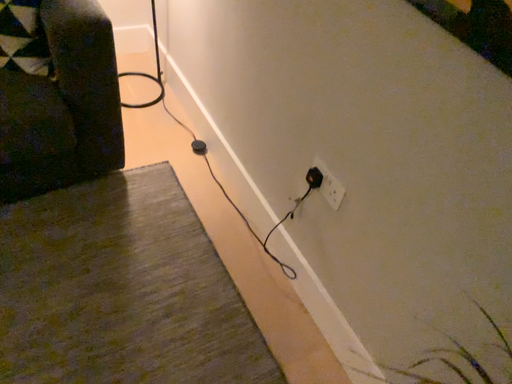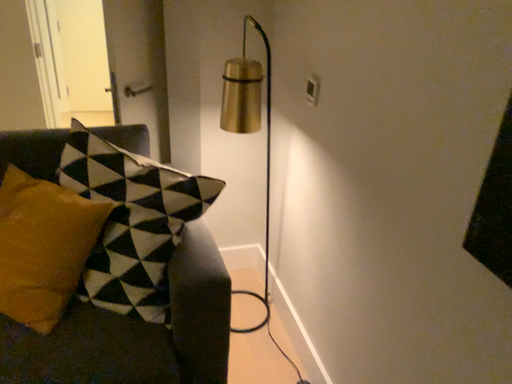
Question: Which way did the camera rotate in the video?

Choices:
 (A) rotated left
 (B) rotated right

Answer: (A)